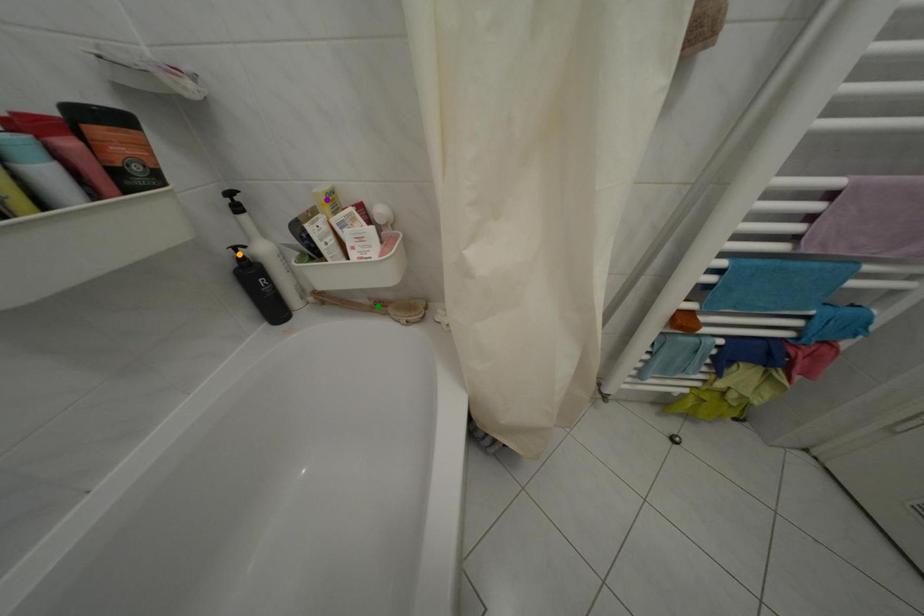
Order these from nearest to farthest:
1. purple point
2. green point
3. orange point

green point
orange point
purple point